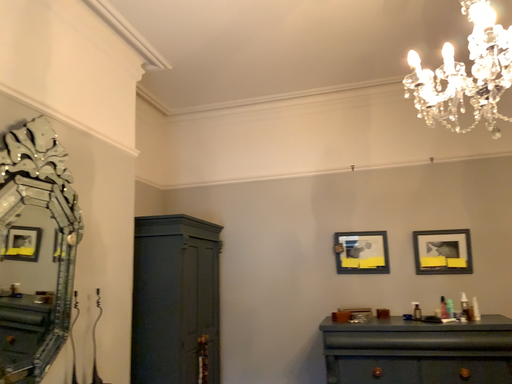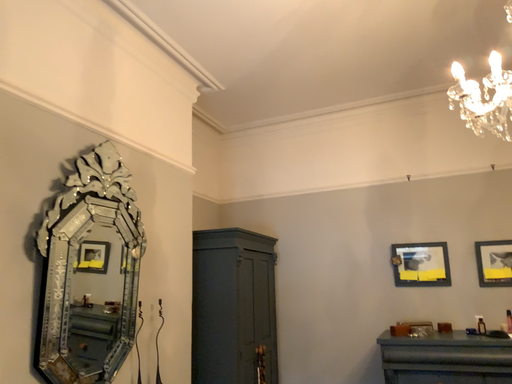
Question: How did the camera likely rotate when shooting the video?

Choices:
 (A) rotated right
 (B) rotated left

Answer: (B)